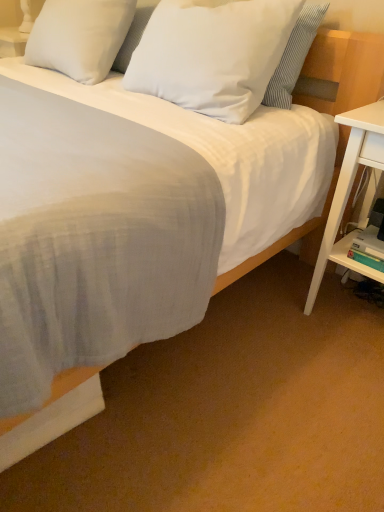
Question: Does white wood nightstand at right come behind white plastic shelf at lower right?

Choices:
 (A) no
 (B) yes

Answer: (A)

Question: Could you tell me if white wood nightstand at right is turned towards white plastic shelf at lower right?

Choices:
 (A) no
 (B) yes

Answer: (B)

Question: Considering the relative sizes of white wood nightstand at right and white plastic shelf at lower right in the image provided, is white wood nightstand at right smaller than white plastic shelf at lower right?

Choices:
 (A) yes
 (B) no

Answer: (B)

Question: Considering the relative sizes of white wood nightstand at right and white plastic shelf at lower right in the image provided, is white wood nightstand at right shorter than white plastic shelf at lower right?

Choices:
 (A) yes
 (B) no

Answer: (B)

Question: From a real-world perspective, is white wood nightstand at right under white plastic shelf at lower right?

Choices:
 (A) yes
 (B) no

Answer: (B)

Question: From their relative heights in the image, would you say white plastic shelf at lower right is taller or shorter than white soft pillow at upper center, placed as the 1th pillow when sorted from left to right?

Choices:
 (A) tall
 (B) short

Answer: (B)

Question: Does point (337, 251) appear closer or farther from the camera than point (76, 23)?

Choices:
 (A) closer
 (B) farther

Answer: (A)

Question: Is white plastic shelf at lower right bigger or smaller than white soft pillow at upper center, which appears as the second pillow when viewed from the right?

Choices:
 (A) big
 (B) small

Answer: (B)

Question: Is white plastic shelf at lower right situated inside white soft pillow at upper center, which appears as the second pillow when viewed from the right, or outside?

Choices:
 (A) outside
 (B) inside

Answer: (A)

Question: Is white matte pillow at upper center, which appears as the 1th pillow when viewed from the right, taller or shorter than white plastic shelf at lower right?

Choices:
 (A) tall
 (B) short

Answer: (A)

Question: Considering their positions, is white matte pillow at upper center, which appears as the 1th pillow when viewed from the right, located in front of or behind white plastic shelf at lower right?

Choices:
 (A) behind
 (B) front

Answer: (B)

Question: Based on their positions, is white matte pillow at upper center, acting as the 2th pillow starting from the left, located to the left or right of white plastic shelf at lower right?

Choices:
 (A) left
 (B) right

Answer: (A)

Question: Based on their sizes in the image, would you say white matte pillow at upper center, acting as the 2th pillow starting from the left, is bigger or smaller than white plastic shelf at lower right?

Choices:
 (A) big
 (B) small

Answer: (A)

Question: Is white wood nightstand at right taller or shorter than white matte pillow at upper center, which appears as the 1th pillow when viewed from the right?

Choices:
 (A) tall
 (B) short

Answer: (A)

Question: Is point (349, 159) closer or farther from the camera than point (244, 70)?

Choices:
 (A) closer
 (B) farther

Answer: (A)